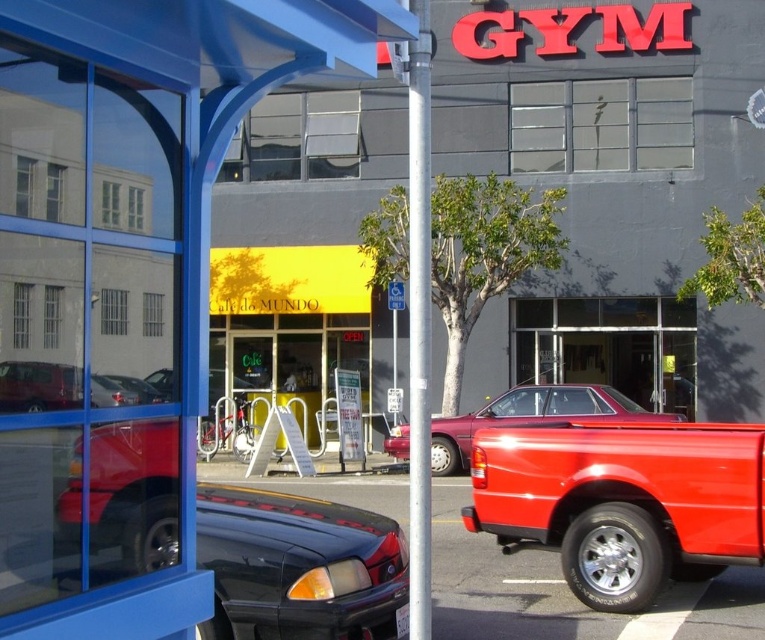
You are a pedestrian standing at the blue bus stop shelter and want to cross the street to the gray building. Which vehicle, the shiny red pickup truck at center or the shiny black sedan at center, is closer to you as you look straight ahead?

The shiny red pickup truck at center is closer to you because it is located below the shiny black sedan at center, which means it is positioned lower in the image and thus closer to your viewpoint.

You are standing at the blue bus stop shelter in the foreground of the street scene. You notice a point marked at coordinates (298,566). What object is located at that point?

The point at coordinates (298,566) marks the glossy black car at center.

You are a delivery driver who needs to park your vehicle in a spot that can accommodate your truck. You see the shiny red pickup truck at center and the matte red truck at left. Which truck requires a larger parking space?

The shiny red pickup truck at center requires a larger parking space because it is bigger than the matte red truck at left.